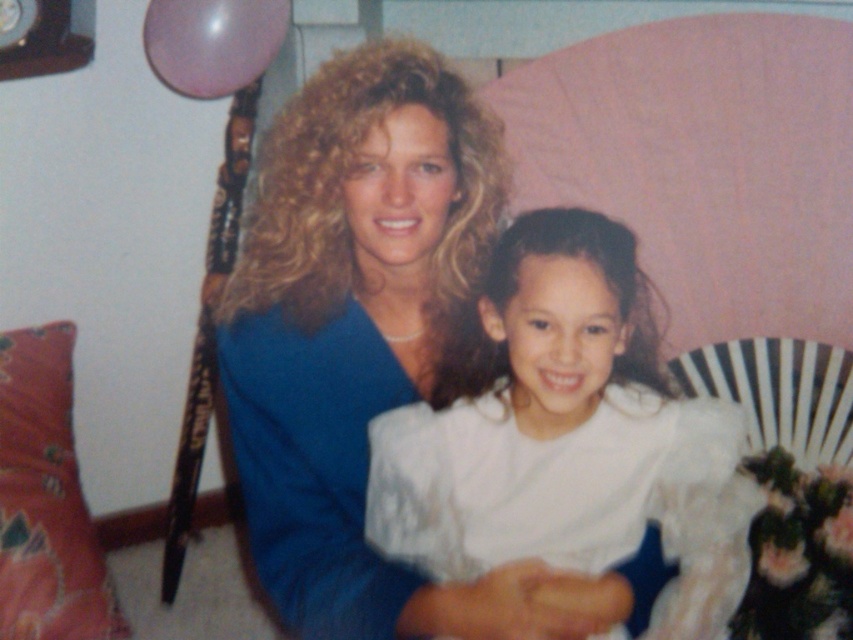
Is point (537, 538) farther from viewer compared to point (38, 625)?

No, it is not.

Does point (554, 456) come in front of point (53, 554)?

Yes, it is.

You are a GUI agent. You are given a task and a screenshot of the screen. Output one action in this format:
    pyautogui.click(x=<x>, y=<y>)
    Task: Click on the white satin dress at center
    The image size is (853, 640).
    Given the screenshot: What is the action you would take?
    pyautogui.click(x=561, y=433)

Does blue satin dress at center have a greater width compared to white satin dress at center?

Incorrect, blue satin dress at center's width does not surpass white satin dress at center's.

Can you confirm if blue satin dress at center is taller than white satin dress at center?

Indeed, blue satin dress at center has a greater height compared to white satin dress at center.

Who is more forward, (399,577) or (628,400)?

Point (399,577) is in front.

At what (x,y) coordinates should I click in order to perform the action: click on blue satin dress at center. Please return your answer as a coordinate pair (x, y). This screenshot has height=640, width=853. Looking at the image, I should click on (347, 312).

Is blue satin dress at center to the right of floral fabric pillow at lower left from the viewer's perspective?

Indeed, blue satin dress at center is positioned on the right side of floral fabric pillow at lower left.

Is blue satin dress at center thinner than floral fabric pillow at lower left?

No.

This screenshot has width=853, height=640. Identify the location of blue satin dress at center. (347, 312).